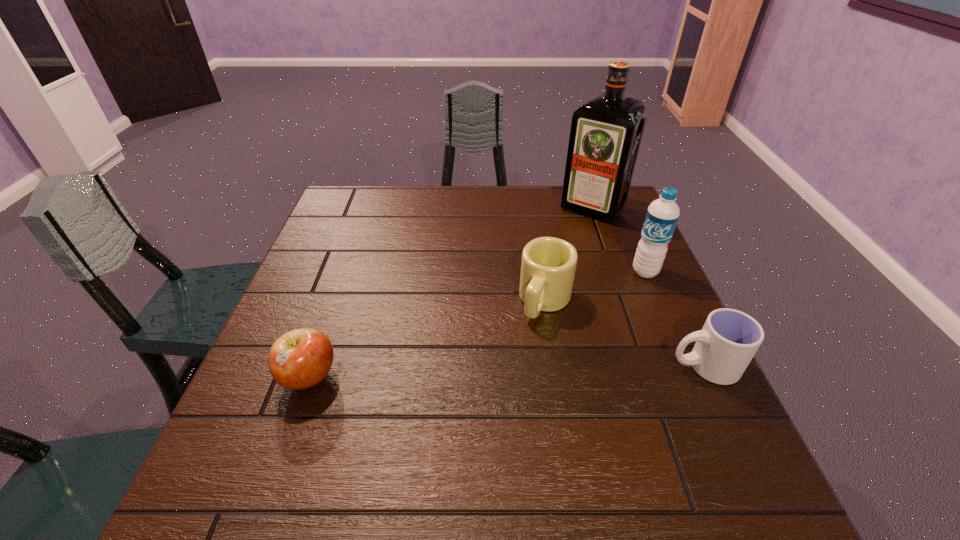
Find the location of a particular element. The height and width of the screenshot is (540, 960). vacant space on the desktop that is between the apple and the cup and is positioned with the handle on the side of the fourth object from right to left is located at coordinates (510, 372).

At what (x,y) coordinates should I click in order to perform the action: click on free space on the desktop that is between the leftmost object and the cup and is positioned on the label of the second tallest object. Please return your answer as a coordinate pair (x, y). The height and width of the screenshot is (540, 960). Looking at the image, I should click on (521, 371).

The image size is (960, 540). I want to click on free space on the desktop that is between the leftmost object and the cup and is positioned on the front label of the tallest object, so click(458, 373).